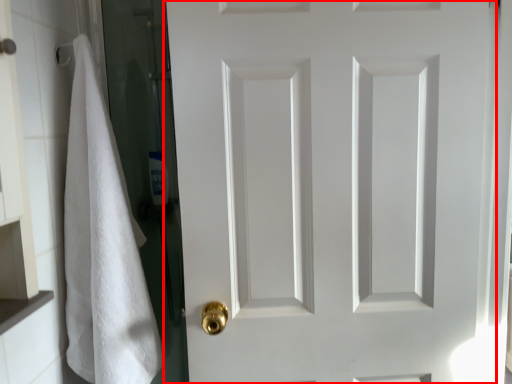
Question: From the image's perspective, considering the relative positions of door (annotated by the red box) and bath towel in the image provided, where is door (annotated by the red box) located with respect to the staircase?

Choices:
 (A) above
 (B) below

Answer: (A)